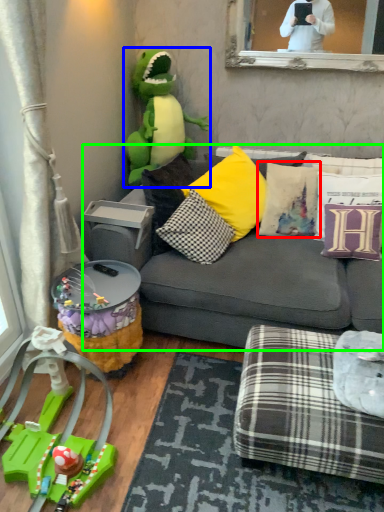
Question: Estimate the real-world distances between objects in this image. Which object is farther from pillow (highlighted by a red box), toy (highlighted by a blue box) or studio couch (highlighted by a green box)?

Choices:
 (A) toy
 (B) studio couch

Answer: (A)